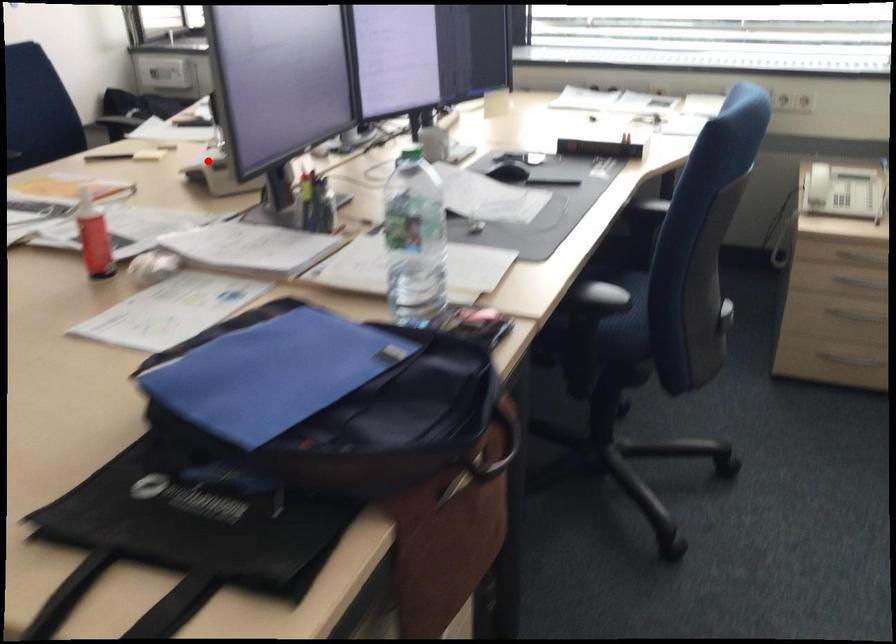
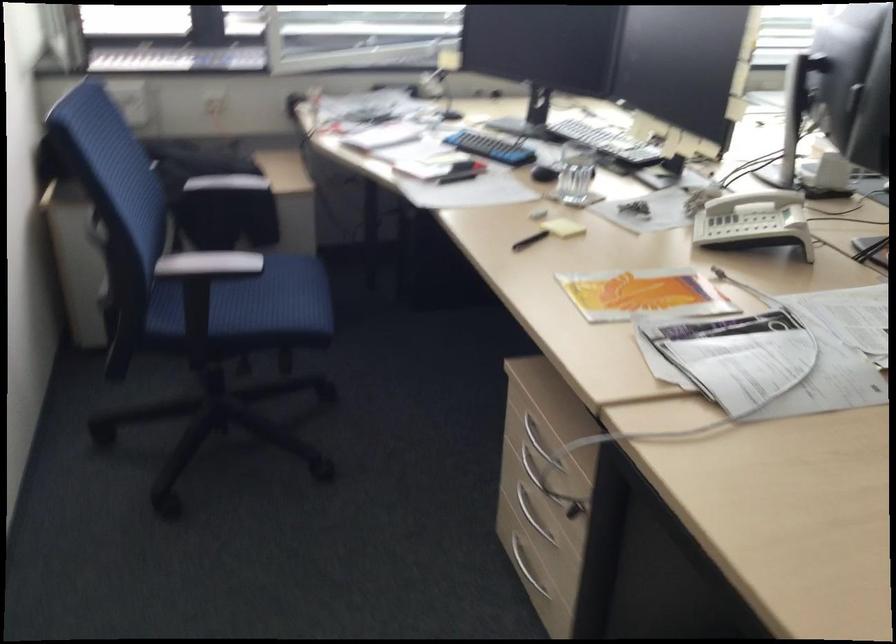
Find the pixel in the second image that matches the highlighted location in the first image.

(751, 225)